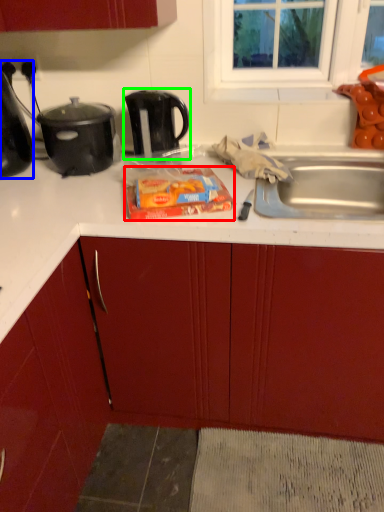
Question: Which is nearer to the food (highlighted by a red box)? kitchen appliance (highlighted by a blue box) or kettle (highlighted by a green box).

Choices:
 (A) kitchen appliance
 (B) kettle

Answer: (B)